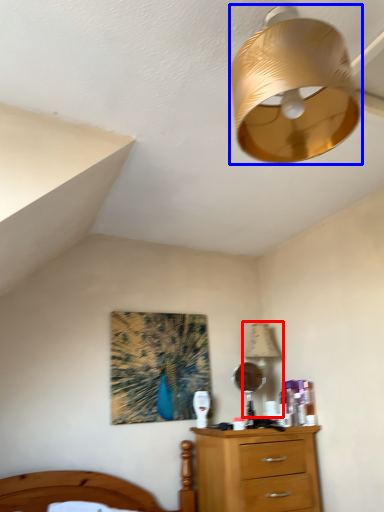
Question: Which of the following is the farthest to the observer, table lamp (highlighted by a red box) or lamp (highlighted by a blue box)?

Choices:
 (A) table lamp
 (B) lamp

Answer: (A)